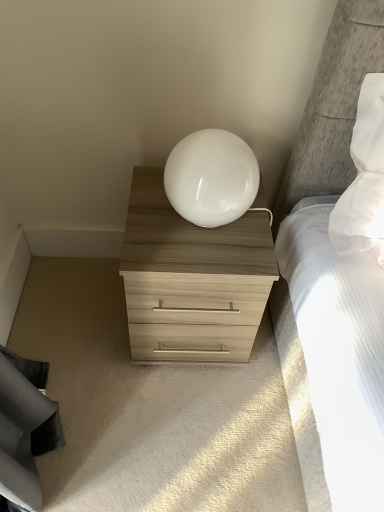
Where is `vacant space that is to the left of white glossy sphere at center`? vacant space that is to the left of white glossy sphere at center is located at coordinates (144, 209).